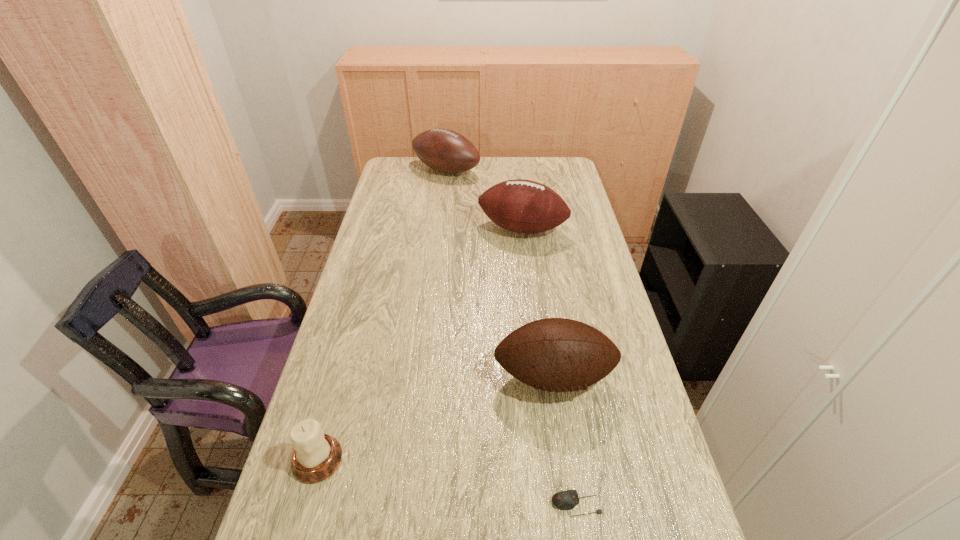
At what (x,y) coordinates should I click in order to perform the action: click on free region at the far right corner. Please return your answer as a coordinate pair (x, y). Looking at the image, I should click on (545, 176).

Identify the location of vacant area that lies between the third farthest object and the mouse. The height and width of the screenshot is (540, 960). (565, 441).

Find the location of a particular element. free space that is in between the second nearest object and the nearest object is located at coordinates (447, 482).

I want to click on vacant space in between the nearest object and the nearest football, so click(565, 441).

The width and height of the screenshot is (960, 540). I want to click on vacant area that lies between the farthest football and the leftmost object, so click(382, 315).

The width and height of the screenshot is (960, 540). In order to click on free space between the third farthest object and the second nearest football in this screenshot , I will do `click(538, 303)`.

The height and width of the screenshot is (540, 960). I want to click on vacant area between the nearest football and the mouse, so click(565, 441).

I want to click on object identified as the fourth closest to the nearest football, so click(x=446, y=151).

Find the location of a particular element. This screenshot has height=540, width=960. object that ranks as the second closest to the farthest football is located at coordinates (553, 354).

Locate which football is the closest to the second nearest football. Please provide its 2D coordinates. Your answer should be formatted as a tuple, i.e. [(x, y)], where the tuple contains the x and y coordinates of a point satisfying the conditions above.

[(446, 151)]